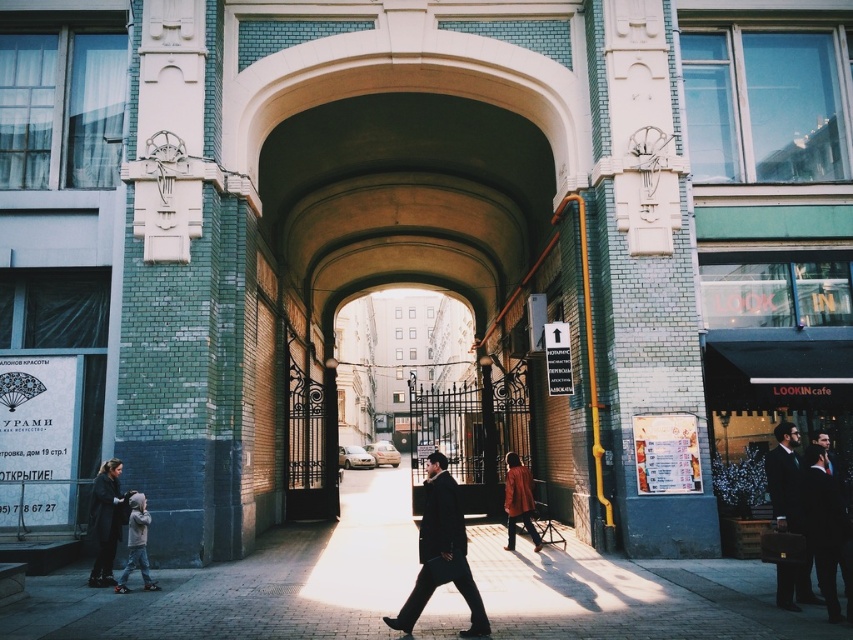
You are a photographer standing at the entrance of the gateway. You notice a person wearing a dark suit at right and another wearing a light gray jacket at lower left. Which clothing item appears bigger in your camera view?

The dark suit at right appears bigger in the camera view because it has a larger size compared to the light gray jacket at lower left.

In the scene shown: You are a photographer standing in front of the gateway. You want to take a photo that includes both the dark suit at right and the light gray jacket at lower left. Which of the two clothing items appears narrower in the photo?

The dark suit at right appears narrower in the photo because it is thinner than the light gray jacket at lower left.